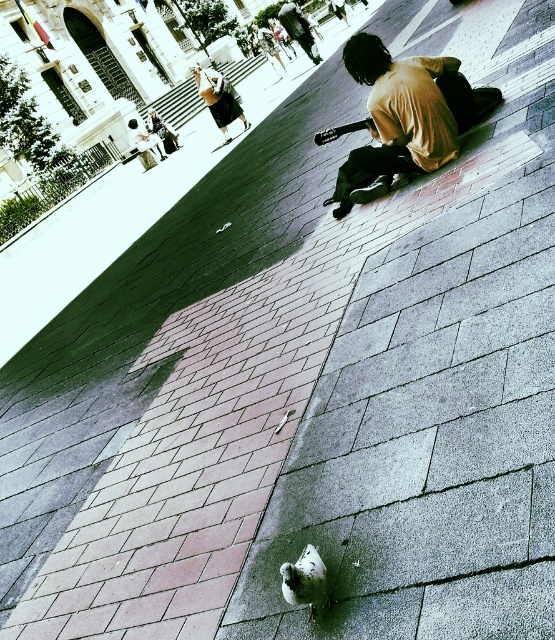
Question: Which point appears closest to the camera in this image?

Choices:
 (A) (204, 74)
 (B) (285, 29)
 (C) (355, 64)

Answer: (C)

Question: Is matte yellow shirt at upper center positioned before brown leather jacket at upper center?

Choices:
 (A) yes
 (B) no

Answer: (A)

Question: Considering the real-world distances, which object is farthest from the light brown cotton shirt at lower right?

Choices:
 (A) white matte pigeon at lower center
 (B) brown leather jacket at upper center
 (C) matte yellow shirt at upper center

Answer: (B)

Question: Is matte yellow shirt at upper center to the left of brown leather jacket at upper center from the viewer's perspective?

Choices:
 (A) yes
 (B) no

Answer: (A)

Question: Can you confirm if white matte pigeon at lower center is bigger than matte yellow shirt at upper center?

Choices:
 (A) yes
 (B) no

Answer: (B)

Question: Which point appears closest to the camera in this image?

Choices:
 (A) (280, 20)
 (B) (326, 592)

Answer: (B)